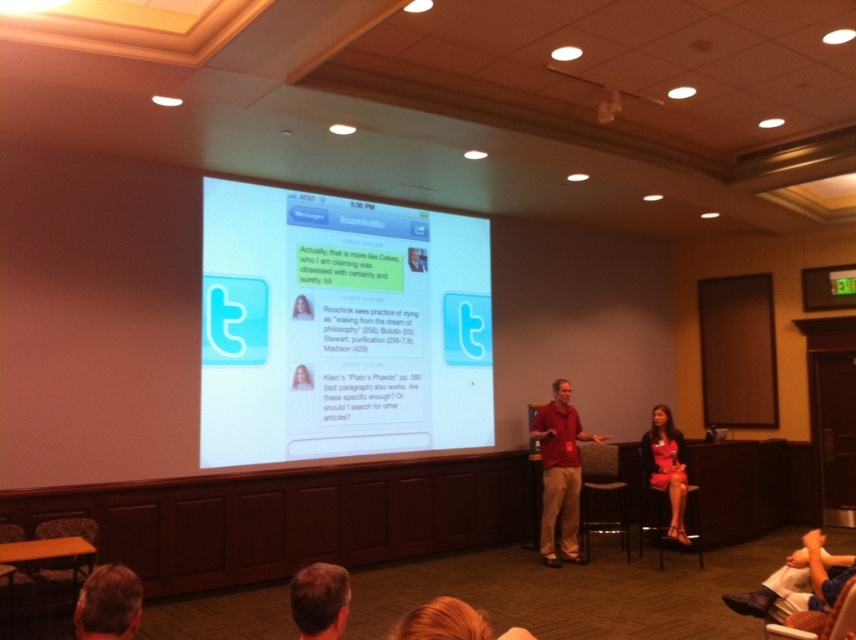
Question: Does blonde hair at lower left appear on the left side of light brown hair at lower center?

Choices:
 (A) no
 (B) yes

Answer: (B)

Question: Which of the following is the farthest from the observer?

Choices:
 (A) matte pink dress at lower right
 (B) white glossy projection screen at center
 (C) light brown hair at lower center

Answer: (A)

Question: Is matte red shirt at center above light brown hair at lower center?

Choices:
 (A) yes
 (B) no

Answer: (B)

Question: Which object is positioned closest to the blonde hair at lower left?

Choices:
 (A) matte pink dress at lower right
 (B) light brown hair at lower center
 (C) white glossy projection screen at center
 (D) matte red shirt at center

Answer: (B)

Question: Which of the following is the closest to the observer?

Choices:
 (A) (684, 467)
 (B) (548, 451)
 (C) (307, 230)

Answer: (C)

Question: Is blonde hair at lower left above matte pink dress at lower right?

Choices:
 (A) no
 (B) yes

Answer: (B)